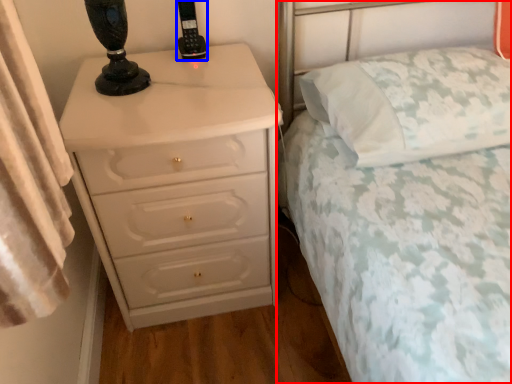
Question: Which object is closer to the camera taking this photo, bed (highlighted by a red box) or control (highlighted by a blue box)?

Choices:
 (A) bed
 (B) control

Answer: (A)